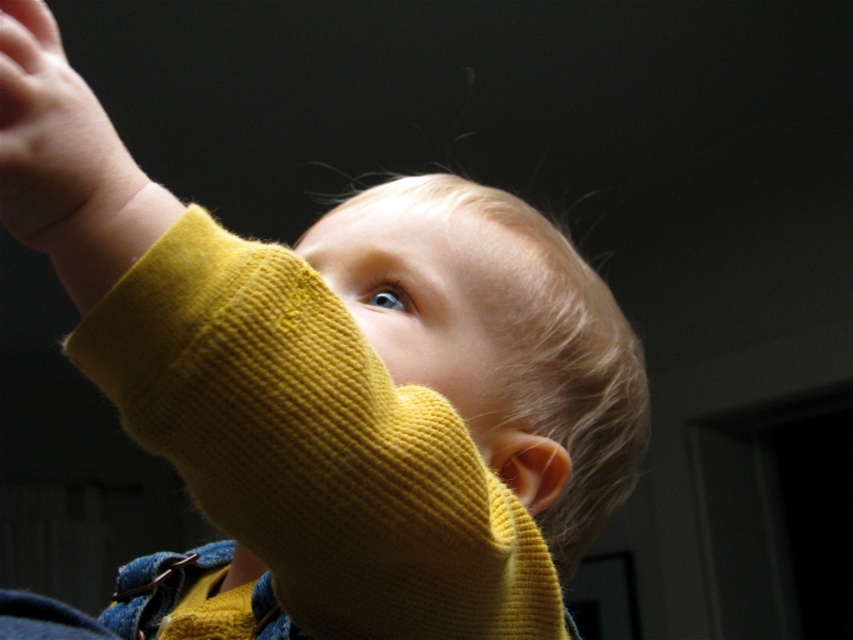
What are the exact coordinates of the smooth yellow sweater at center in the image?

The smooth yellow sweater at center is located at point [436,301].

Consider the image. You are a tailor trying to determine if the smooth yellow sleeve at upper left can fit into the smooth yellow sweater at center. Based on their heights, can the sleeve be attached properly?

The smooth yellow sweater at center has a greater height compared to the smooth yellow sleeve at upper left, so the sleeve can be attached properly as it is shorter than the sweater.

You are a tailor measuring a child for a new sweater. The child is wearing a smooth yellow sweater at center and a smooth yellow sleeve at upper left. Which part of the sweater is wider?

The smooth yellow sweater at center is wider than the smooth yellow sleeve at upper left.